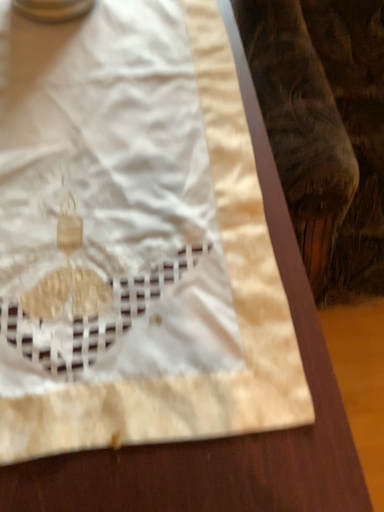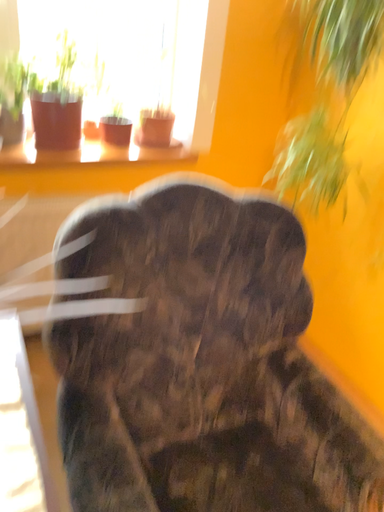
Question: Which way did the camera rotate in the video?

Choices:
 (A) rotated downward
 (B) rotated upward

Answer: (B)